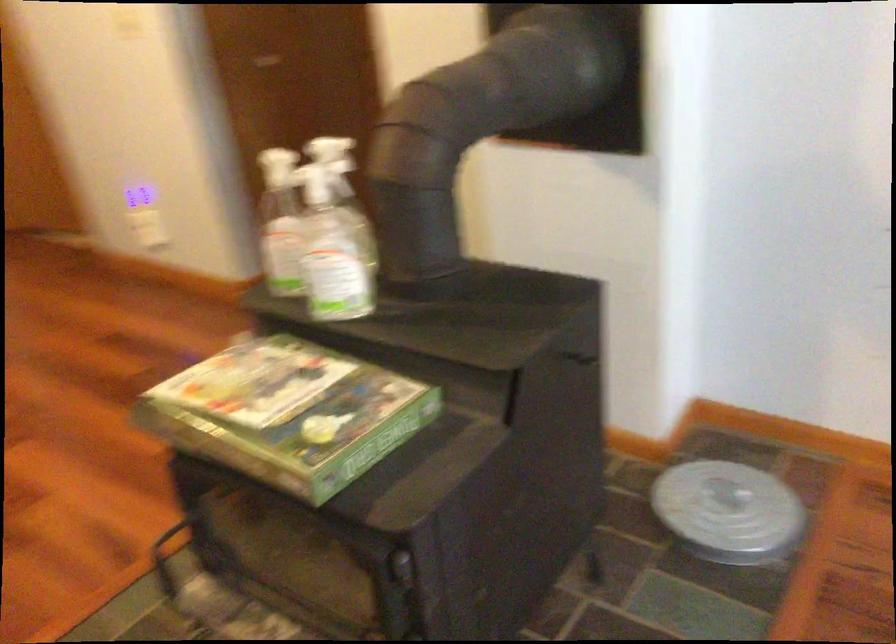
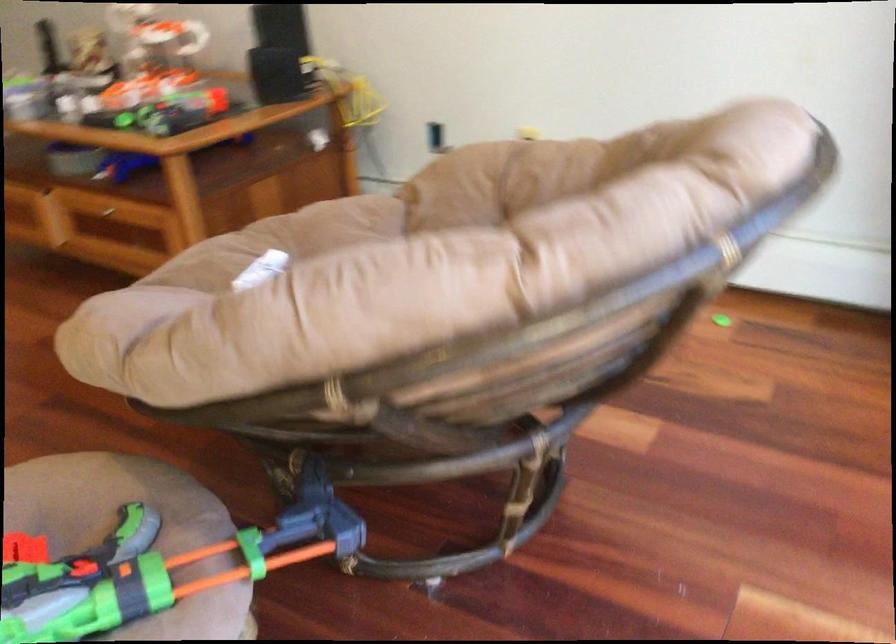
In a continuous first-person perspective shot, in which direction is the camera moving?

The movement direction of the cameraman is right, backward.